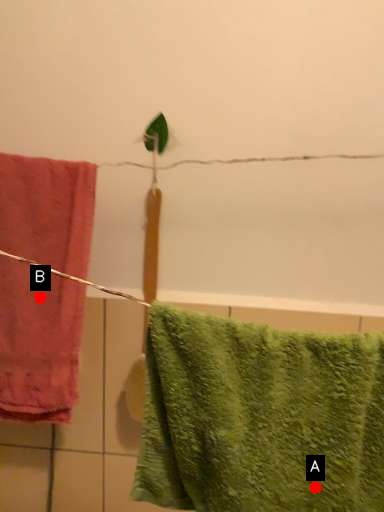
Question: Two points are circled on the image, labeled by A and B beside each circle. Which point appears closest to the camera in this image?

Choices:
 (A) A is closer
 (B) B is closer

Answer: (A)